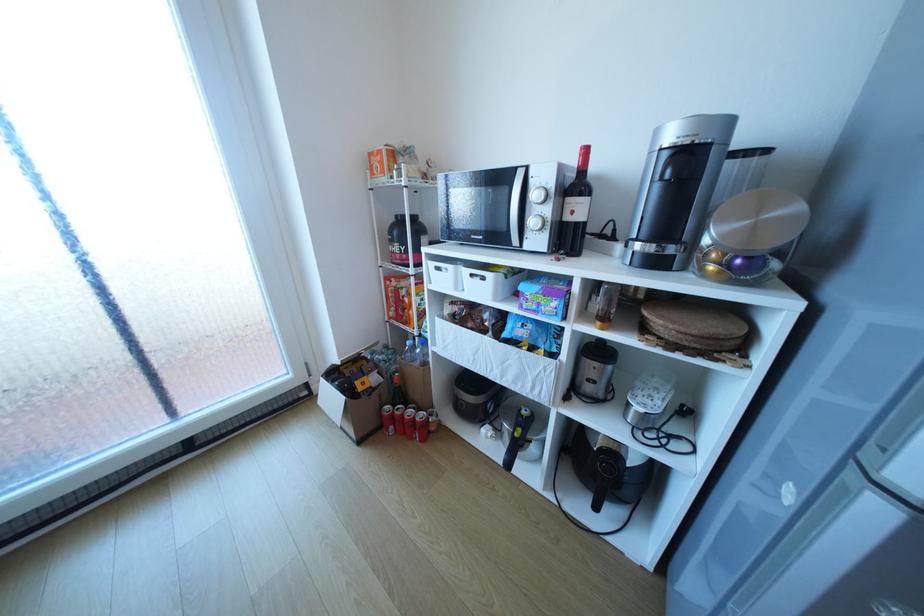
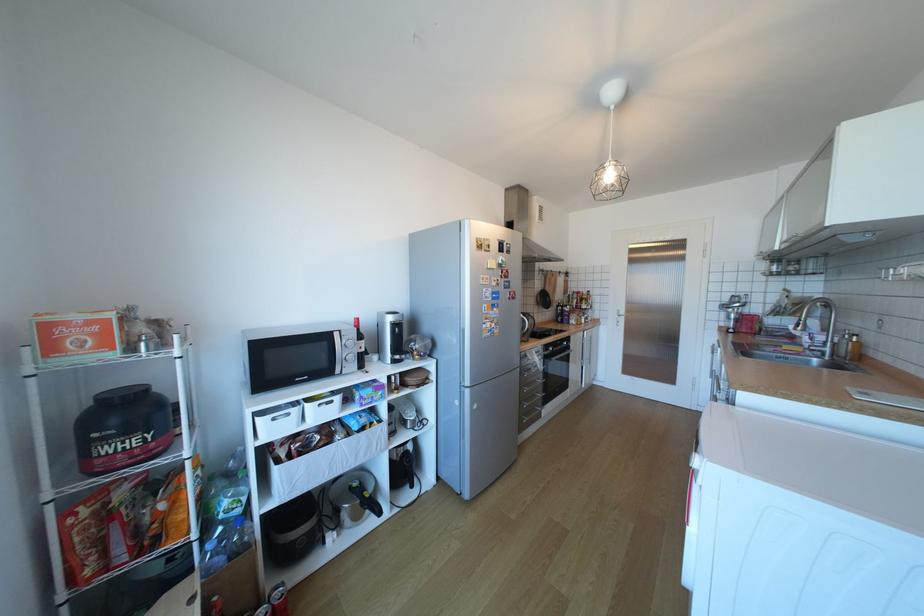
Locate, in the second image, the point that corresponds to the point at 446,268 in the first image.

(283, 419)